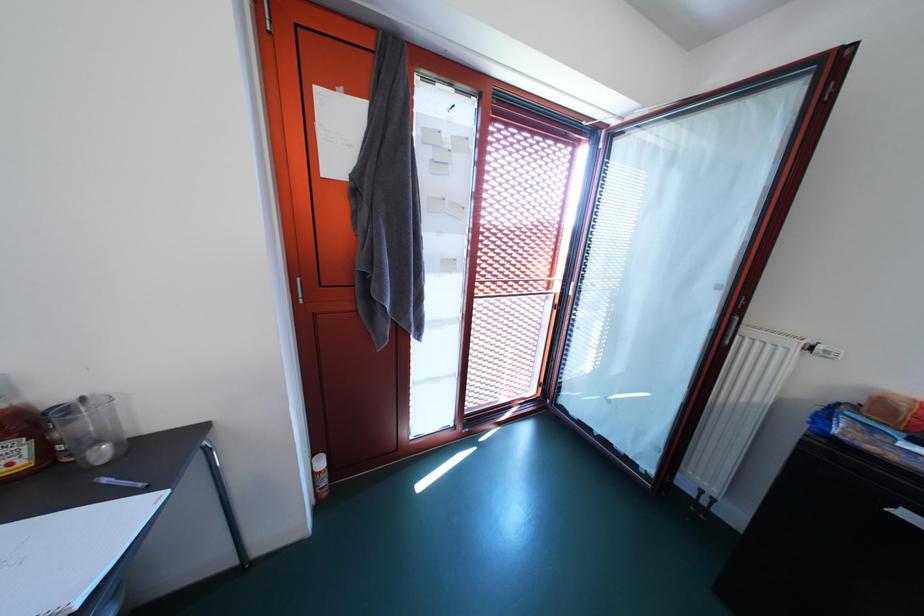
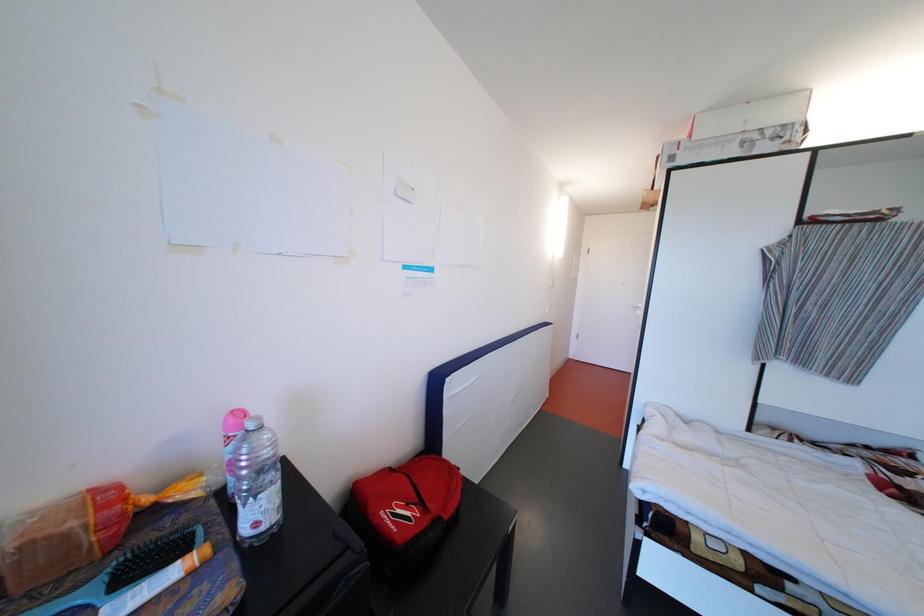
The images are taken continuously from a first-person perspective. In which direction is your viewpoint rotating?

The camera's rotation is toward right-down.